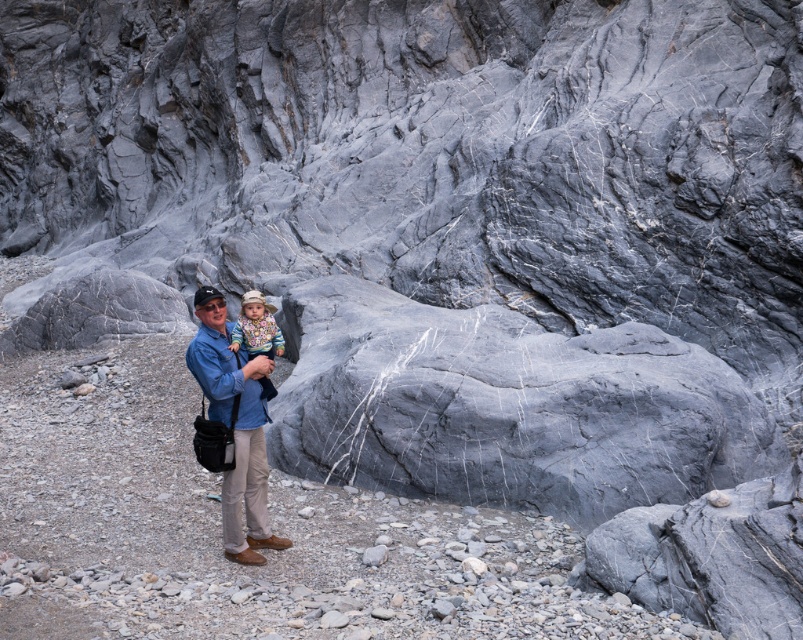
Question: Is matte blue shirt at center positioned before multicolored knitted sweater at center?

Choices:
 (A) yes
 (B) no

Answer: (A)

Question: In this image, where is matte blue shirt at center located relative to multicolored knitted sweater at center?

Choices:
 (A) left
 (B) right

Answer: (A)

Question: Can you confirm if matte blue shirt at center is positioned above multicolored knitted sweater at center?

Choices:
 (A) yes
 (B) no

Answer: (B)

Question: Which point is closer to the camera?

Choices:
 (A) (267, 372)
 (B) (257, 323)

Answer: (A)

Question: Which of the following is the closest to the observer?

Choices:
 (A) (257, 353)
 (B) (227, 355)

Answer: (B)